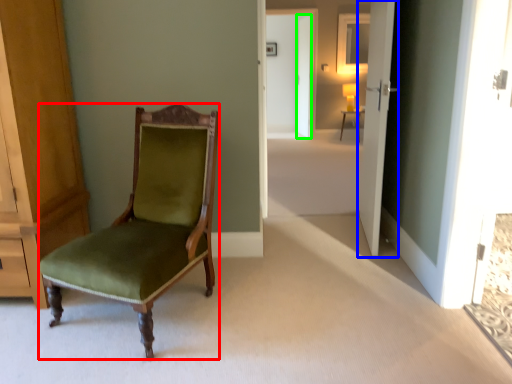
Question: Based on their relative distances, which object is nearer to chair (highlighted by a red box)? Choose from door (highlighted by a blue box) and door (highlighted by a green box).

Choices:
 (A) door
 (B) door

Answer: (A)